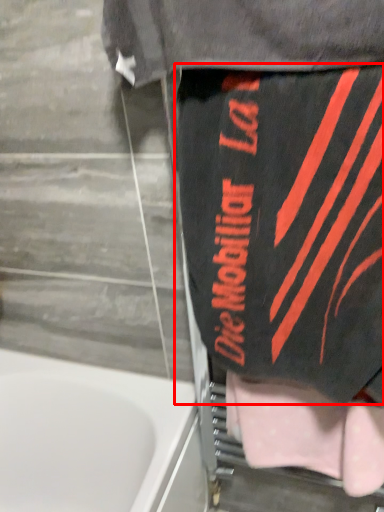
Question: From the image's perspective, what is the correct spatial relationship of underclothes (annotated by the red box) in relation to towel?

Choices:
 (A) below
 (B) above

Answer: (B)